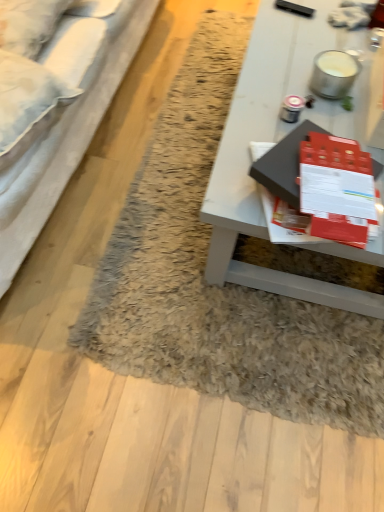
Question: Is fuzzy rug at center taller than matte black book at center?

Choices:
 (A) yes
 (B) no

Answer: (B)

Question: From the image's perspective, is fuzzy rug at center on top of matte black book at center?

Choices:
 (A) no
 (B) yes

Answer: (B)

Question: Is fuzzy rug at center at the left side of matte black book at center?

Choices:
 (A) no
 (B) yes

Answer: (A)

Question: Is matte black book at center surrounded by fuzzy rug at center?

Choices:
 (A) yes
 (B) no

Answer: (B)

Question: Considering the relative sizes of fuzzy rug at center and matte black book at center in the image provided, is fuzzy rug at center bigger than matte black book at center?

Choices:
 (A) yes
 (B) no

Answer: (A)

Question: Is fuzzy rug at center positioned with its back to matte black book at center?

Choices:
 (A) no
 (B) yes

Answer: (A)

Question: Does matte black book at center have a lesser height compared to white fabric studio couch at left?

Choices:
 (A) yes
 (B) no

Answer: (A)

Question: From the image's perspective, does matte black book at center appear lower than white fabric studio couch at left?

Choices:
 (A) yes
 (B) no

Answer: (A)

Question: Is matte black book at center taller than white fabric studio couch at left?

Choices:
 (A) yes
 (B) no

Answer: (B)

Question: Does matte black book at center appear on the left side of white fabric studio couch at left?

Choices:
 (A) no
 (B) yes

Answer: (A)

Question: Is matte black book at center smaller than white fabric studio couch at left?

Choices:
 (A) yes
 (B) no

Answer: (A)

Question: Considering the relative sizes of matte black book at center and white fabric studio couch at left in the image provided, is matte black book at center bigger than white fabric studio couch at left?

Choices:
 (A) no
 (B) yes

Answer: (A)

Question: Is white glossy table at center inside fuzzy rug at center?

Choices:
 (A) yes
 (B) no

Answer: (B)